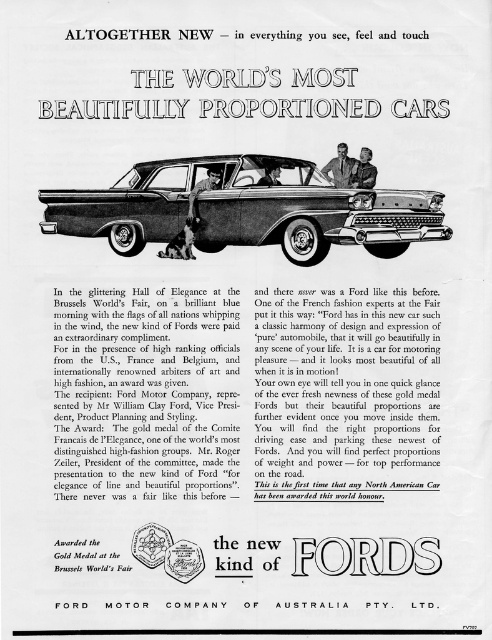
Question: Is shiny dark brown car at center to the right of dark suit jacket at center from the viewer's perspective?

Choices:
 (A) no
 (B) yes

Answer: (A)

Question: Is shiny dark brown car at center above matte black suit at center?

Choices:
 (A) no
 (B) yes

Answer: (A)

Question: Can you confirm if dark blue suit at center is smaller than dark suit jacket at center?

Choices:
 (A) yes
 (B) no

Answer: (B)

Question: Among these objects, which one is farthest from the camera?

Choices:
 (A) dark suit jacket at center
 (B) dark blue suit at center
 (C) matte black car door handle at center
 (D) matte black suit at center

Answer: (D)

Question: Which point is closer to the camera taking this photo?

Choices:
 (A) (363, 150)
 (B) (275, 173)
 (C) (190, 193)
 (D) (344, 237)

Answer: (A)

Question: Which point is farther from the camera taking this photo?

Choices:
 (A) (319, 196)
 (B) (339, 147)
 (C) (271, 184)
 (D) (195, 193)

Answer: (A)